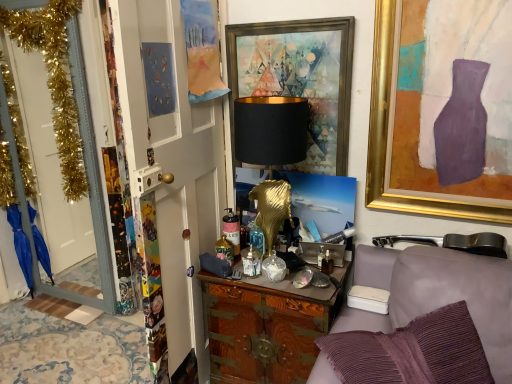
Locate an element on the screen. The image size is (512, 384). vacant space underneath black matte/golden base at center (from a real-world perspective) is located at coordinates (265, 261).